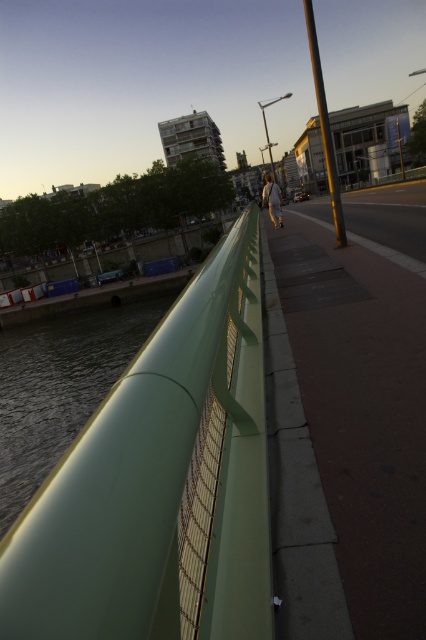
You are standing on the dark gray concrete pavement at center and want to take a photo of the green metal railing in the foreground. Since you need to ensure the railing is in focus, will you have to adjust your camera focus beyond 4 feet?

The distance between the dark gray concrete pavement at center and the camera is 4.12 feet. Since the green metal railing is in the foreground, it is closer to the camera than the pavement. Therefore, you would need to adjust your camera focus to a distance less than 4.12 feet to capture the railing clearly.

You are standing on the green metal railing in the foreground of the bridge. You notice a point marked at coordinates [345,433]. What is located at that point?

The point at coordinates [345,433] corresponds to dark gray concrete pavement at center.

You are standing on the bridge and looking down. You see the dark gray concrete pavement at center and the white fabric at center. Which object is closer to you?

The dark gray concrete pavement at center is closer to the viewer than the white fabric at center.